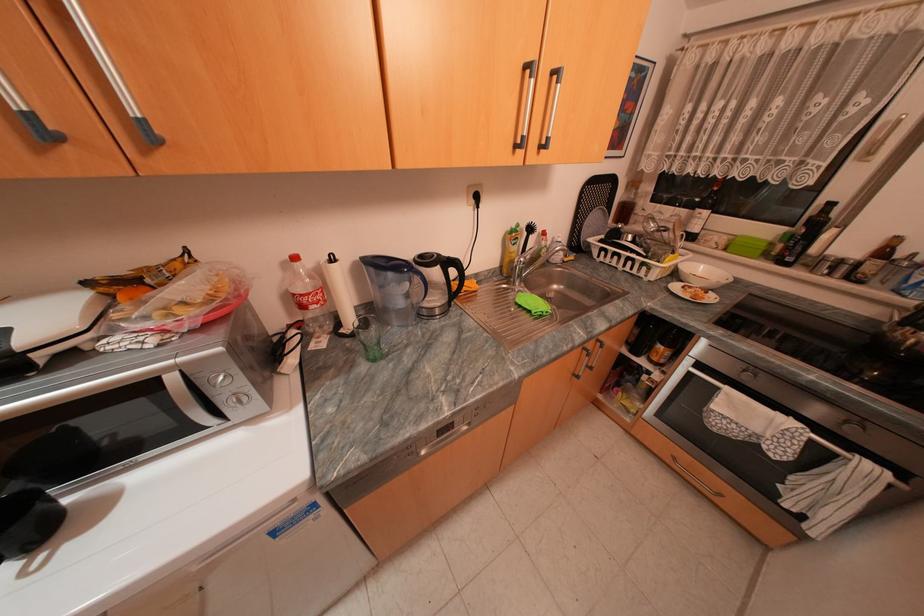
Locate an element on the screen. The image size is (924, 616). the lower cabinet handle is located at coordinates (699, 483).